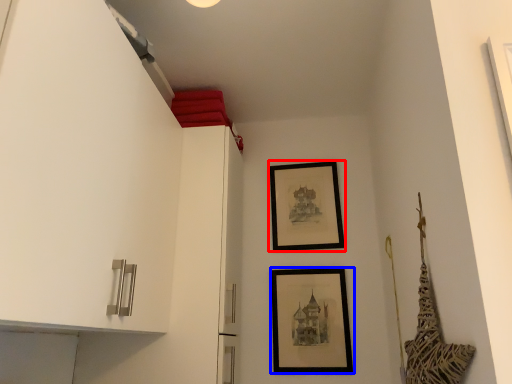
Question: Which object is further to the camera taking this photo, picture frame (highlighted by a red box) or picture frame (highlighted by a blue box)?

Choices:
 (A) picture frame
 (B) picture frame

Answer: (A)